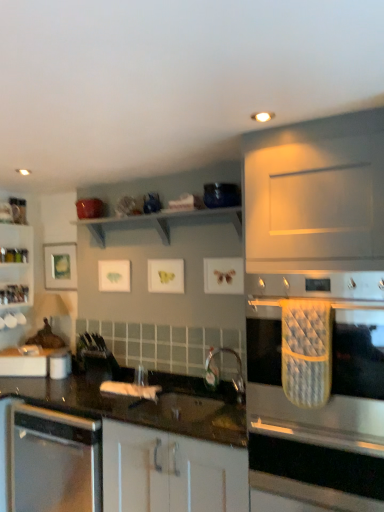
Question: In terms of width, does stainless steel oven mitt at right look wider or thinner when compared to metallic silver faucet at center?

Choices:
 (A) wide
 (B) thin

Answer: (A)

Question: In terms of size, does stainless steel oven mitt at right appear bigger or smaller than metallic silver faucet at center?

Choices:
 (A) small
 (B) big

Answer: (B)

Question: Considering the real-world distances, which object is closest to the clear glass shelves at left?

Choices:
 (A) stainless steel oven mitt at right
 (B) metallic silver faucet at center
 (C) blue glossy bowl at upper center, positioned as the 1th appliance in right-to-left order
 (D) white glossy canister at left, which ranks as the 2th appliance in top-to-bottom order
 (E) satin black countertop at lower left

Answer: (D)

Question: Which object is the closest to the stainless steel oven mitt at right?

Choices:
 (A) metallic silver faucet at center
 (B) satin black countertop at lower left
 (C) clear glass shelves at left
 (D) white glossy canister at left, which ranks as the 2th appliance in top-to-bottom order
 (E) blue glossy bowl at upper center, the first appliance positioned from the front

Answer: (B)